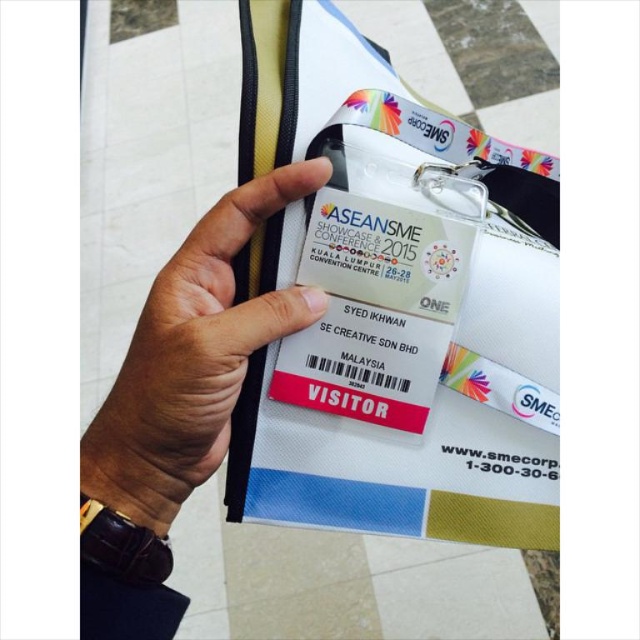
Does point (253, 410) come behind point (120, 387)?

Yes, point (253, 410) is farther from viewer.

Does white fabric badge at center have a greater width compared to brown leather wristwatch at center?

Correct, the width of white fabric badge at center exceeds that of brown leather wristwatch at center.

Is point (376, 296) closer to camera compared to point (109, 388)?

Yes, point (376, 296) is closer to viewer.

This screenshot has width=640, height=640. Find the location of `white fabric badge at center`. white fabric badge at center is located at coordinates (390, 307).